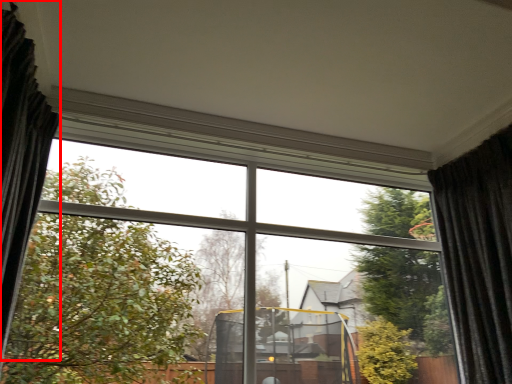
Question: Observing the image, what is the correct spatial positioning of curtain (annotated by the red box) in reference to curtain?

Choices:
 (A) left
 (B) right

Answer: (A)